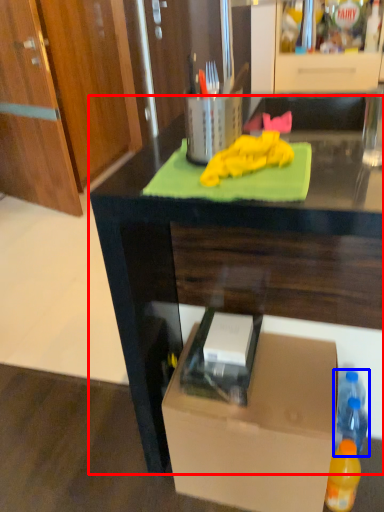
Question: Which object appears closest to the camera in this image, desk (highlighted by a red box) or bottle (highlighted by a blue box)?

Choices:
 (A) desk
 (B) bottle

Answer: (A)